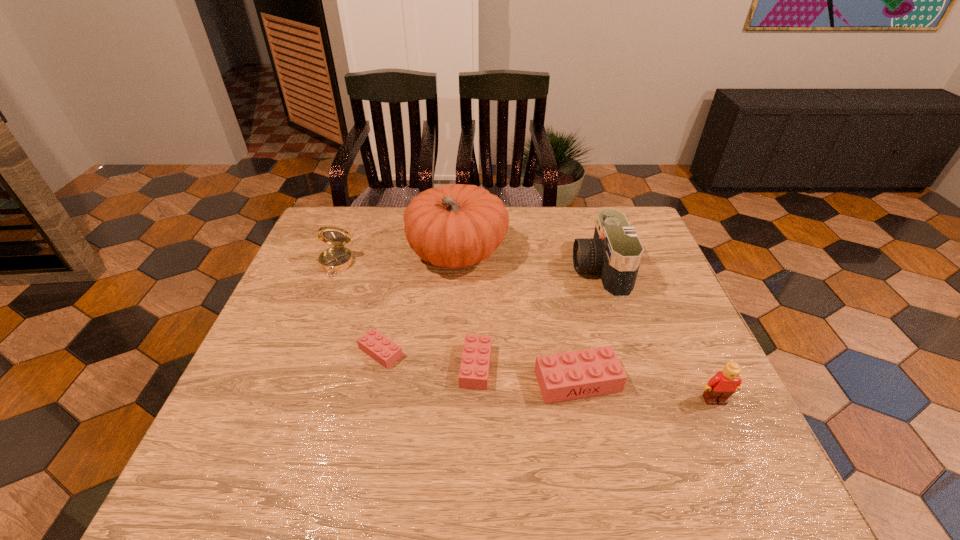
Locate an element on the screen. The height and width of the screenshot is (540, 960). the tallest Lego is located at coordinates (719, 388).

The height and width of the screenshot is (540, 960). Find the location of `vacant space located 0.290m on the back of the shortest Lego`. vacant space located 0.290m on the back of the shortest Lego is located at coordinates (400, 262).

The image size is (960, 540). I want to click on vacant space located on the right of the second Lego from left to right, so click(x=645, y=366).

Find the location of a particular element. This screenshot has height=540, width=960. free location located on the back of the second tallest Lego is located at coordinates (553, 256).

In order to click on free location located on the front-facing side of the camera in this screenshot , I will do `click(448, 269)`.

Find the location of `blank area located on the front-facing side of the camera`. blank area located on the front-facing side of the camera is located at coordinates (535, 269).

Find the location of a particular element. vacant space situated on the front-facing side of the camera is located at coordinates (468, 269).

The height and width of the screenshot is (540, 960). What are the coordinates of `blank area located on the front of the pumpkin` in the screenshot? It's located at (449, 381).

Find the location of `free location located with the dial facing the compass`. free location located with the dial facing the compass is located at coordinates (292, 380).

Find the location of a particular element. The width and height of the screenshot is (960, 540). camera that is at the far edge is located at coordinates (615, 252).